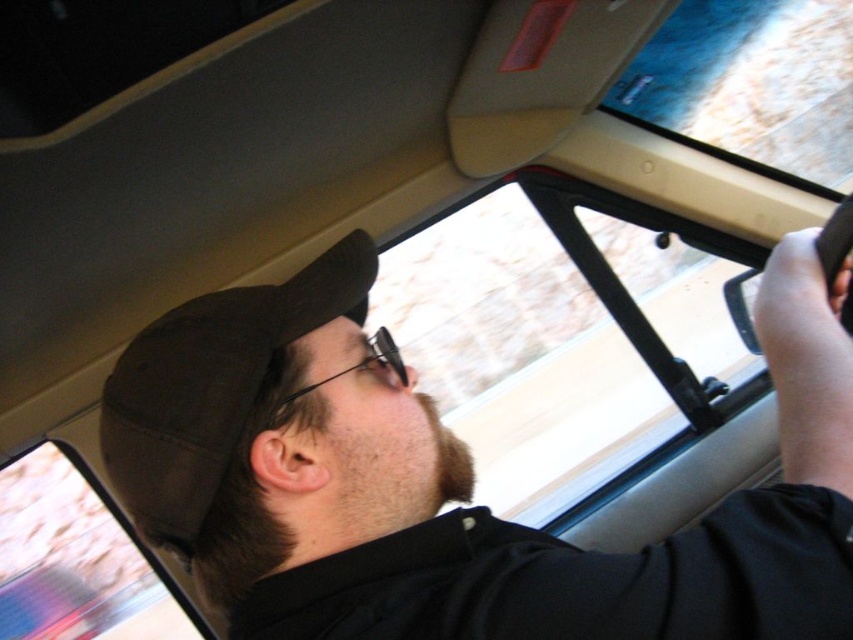
Between black matte cap at upper left and black fabric baseball hat at upper left, which one appears on the right side from the viewer's perspective?

Positioned to the right is black matte cap at upper left.

Who is lower down, black matte cap at upper left or black fabric baseball hat at upper left?

black matte cap at upper left is below.

Which is in front, point (326, 442) or point (144, 436)?

Point (144, 436) is in front.

Where is `black matte cap at upper left`? black matte cap at upper left is located at coordinates (440, 483).